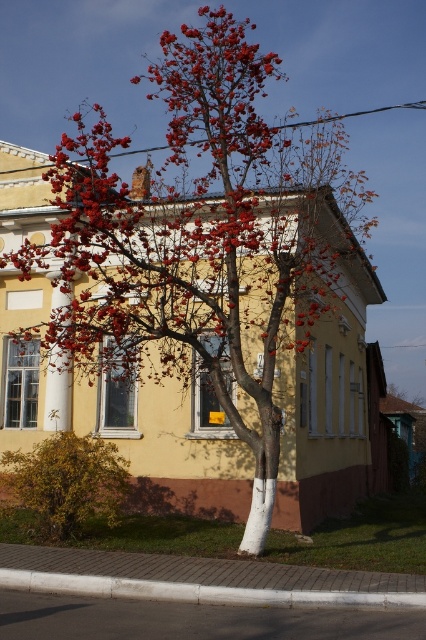
Question: Which point is farther to the camera?

Choices:
 (A) golden-brown foliage at center
 (B) white concrete curb at lower center

Answer: (A)

Question: Is golden-brown foliage at center positioned at the back of white concrete curb at lower center?

Choices:
 (A) no
 (B) yes

Answer: (B)

Question: Is golden-brown foliage at center to the right of white concrete curb at lower center from the viewer's perspective?

Choices:
 (A) yes
 (B) no

Answer: (B)

Question: Among these points, which one is farthest from the camera?

Choices:
 (A) (264, 598)
 (B) (57, 481)

Answer: (B)

Question: Is golden-brown foliage at center thinner than white concrete curb at lower center?

Choices:
 (A) no
 (B) yes

Answer: (B)